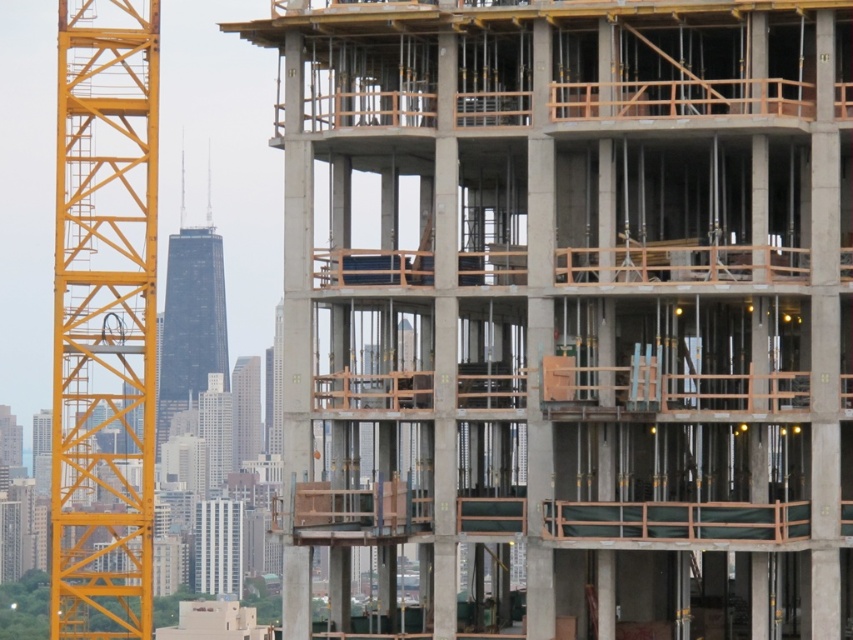
Question: Which object appears closest to the camera in this image?

Choices:
 (A) dark glass skyscraper at center
 (B) yellow metallic crane at left
 (C) concrete building at center
 (D) concrete/wooden construction at center

Answer: (B)

Question: Can you confirm if concrete building at center is smaller than concrete/wooden construction at center?

Choices:
 (A) yes
 (B) no

Answer: (B)

Question: Does yellow metallic crane at left have a greater width compared to concrete building at center?

Choices:
 (A) no
 (B) yes

Answer: (B)

Question: Which point is farther to the camera?

Choices:
 (A) (190, 356)
 (B) (225, 392)
 (C) (103, 412)
 (D) (242, 426)

Answer: (D)

Question: Which of the following is the farthest from the observer?

Choices:
 (A) dark glass skyscraper at center
 (B) concrete building at center
 (C) concrete/wooden construction at center

Answer: (B)

Question: Is yellow metallic crane at left wider than concrete building at center?

Choices:
 (A) yes
 (B) no

Answer: (A)